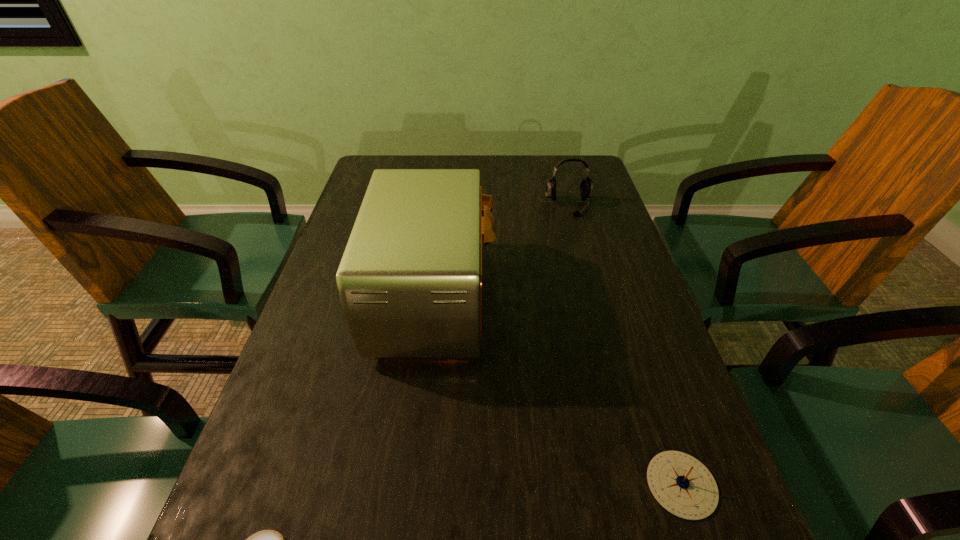
Find the location of a particular element. headset that is at the right edge is located at coordinates (586, 187).

Locate an element on the screen. compass present at the right edge is located at coordinates (679, 482).

This screenshot has width=960, height=540. Identify the location of free space at the far edge of the desktop. (516, 182).

Where is `free space at the left edge of the desktop`? Image resolution: width=960 pixels, height=540 pixels. free space at the left edge of the desktop is located at coordinates coord(293,455).

Identify the location of vacant space at the right edge of the desktop. Image resolution: width=960 pixels, height=540 pixels. (610, 266).

Find the location of a particular element. vacant region at the far left corner of the desktop is located at coordinates (392, 159).

Locate an element on the screen. vacant point located between the third object from right to left and the second tallest object is located at coordinates (502, 252).

The height and width of the screenshot is (540, 960). I want to click on vacant space that is in between the second tallest object and the tallest object, so click(502, 252).

Find the location of a particular element. free space between the second tallest object and the farther compass is located at coordinates (625, 345).

The height and width of the screenshot is (540, 960). I want to click on free space between the right compass and the third shortest object, so click(625, 345).